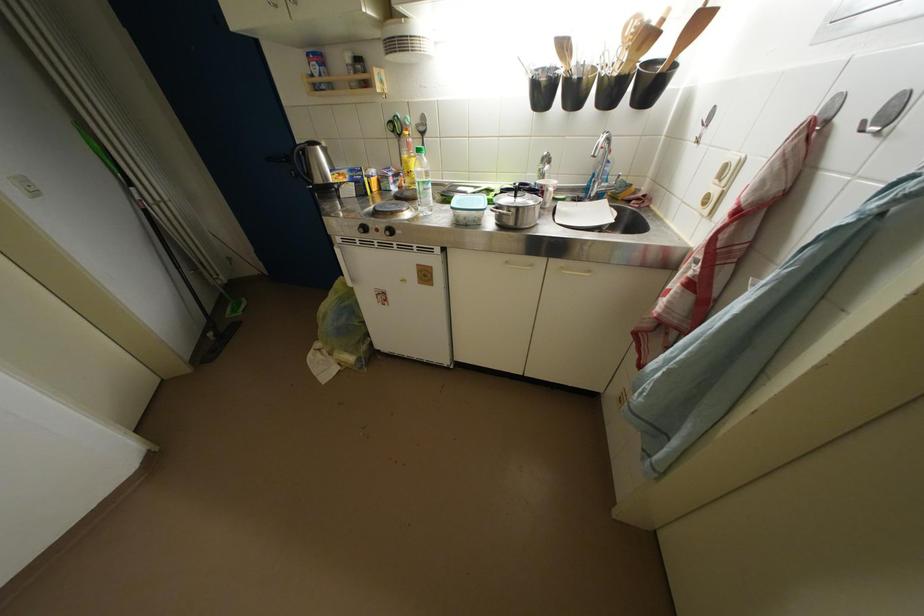
The width and height of the screenshot is (924, 616). I want to click on sink faucet handle, so click(x=614, y=180).